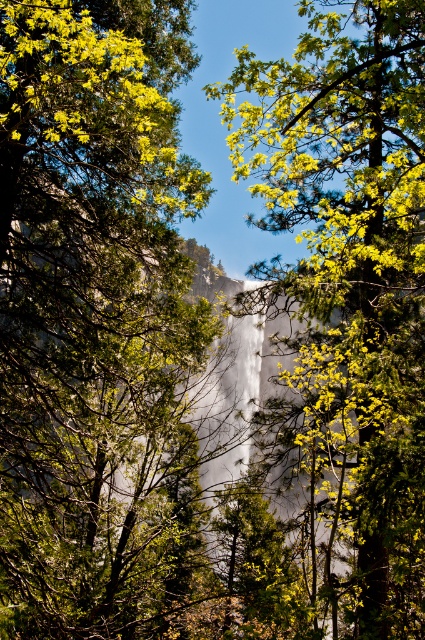
Question: Among these points, which one is nearest to the camera?

Choices:
 (A) (x=68, y=225)
 (B) (x=289, y=371)

Answer: (A)

Question: Is green matte tree at upper left above green leafy tree at center?

Choices:
 (A) no
 (B) yes

Answer: (A)

Question: Is green matte tree at upper left further to camera compared to green leafy tree at center?

Choices:
 (A) no
 (B) yes

Answer: (B)

Question: Which object is closer to the camera taking this photo?

Choices:
 (A) green matte tree at upper left
 (B) green leafy tree at center

Answer: (B)

Question: Among these points, which one is nearest to the camera?

Choices:
 (A) (42, 621)
 (B) (350, 170)

Answer: (A)

Question: Is green matte tree at upper left thinner than green leafy tree at center?

Choices:
 (A) yes
 (B) no

Answer: (B)